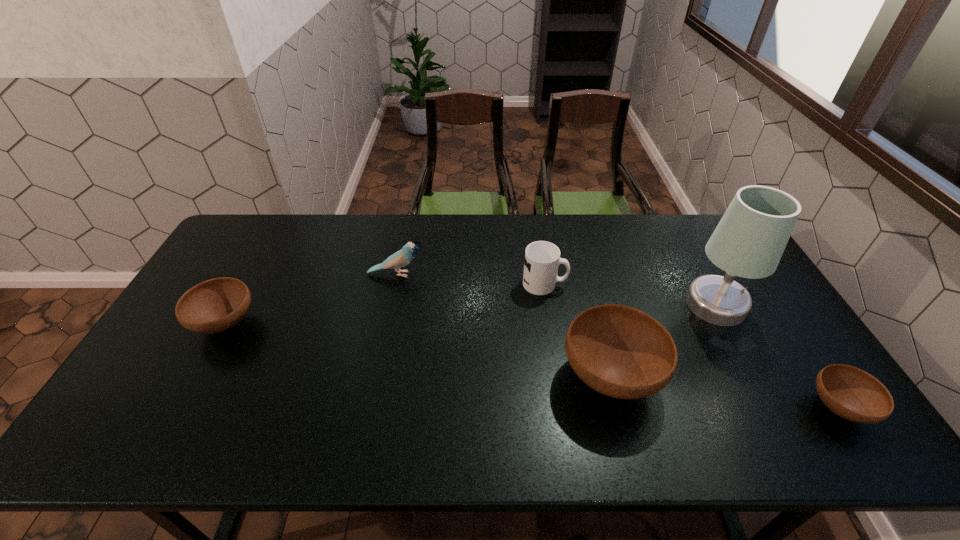
The width and height of the screenshot is (960, 540). Find the location of `vacant space located on the right of the tallest bowl`. vacant space located on the right of the tallest bowl is located at coordinates (688, 376).

The image size is (960, 540). I want to click on vacant space located on the back of the rightmost object, so tap(784, 326).

This screenshot has height=540, width=960. I want to click on blank space located 0.210m at the face of the second object from left to right, so click(x=490, y=274).

You are a GUI agent. You are given a task and a screenshot of the screen. Output one action in this format:
    pyautogui.click(x=<x>, y=<y>)
    Task: Click on the free space located on the base of the tallest object
    
    Given the screenshot: What is the action you would take?
    pyautogui.click(x=769, y=405)

In order to click on vacant region located on the handle side of the mug in this screenshot , I will do `click(595, 284)`.

Where is `object located at the left edge`? The image size is (960, 540). object located at the left edge is located at coordinates (215, 305).

I want to click on bowl present at the right edge, so click(851, 393).

You are a GUI agent. You are given a task and a screenshot of the screen. Output one action in this format:
    pyautogui.click(x=<x>, y=<y>)
    Task: Click on the lampshade positioned at the right edge
    
    Given the screenshot: What is the action you would take?
    pyautogui.click(x=749, y=241)

Where is `object positioned at the near right corner`? The width and height of the screenshot is (960, 540). object positioned at the near right corner is located at coordinates (851, 393).

The height and width of the screenshot is (540, 960). In order to click on vacant space at the far edge of the desktop in this screenshot , I will do `click(639, 225)`.